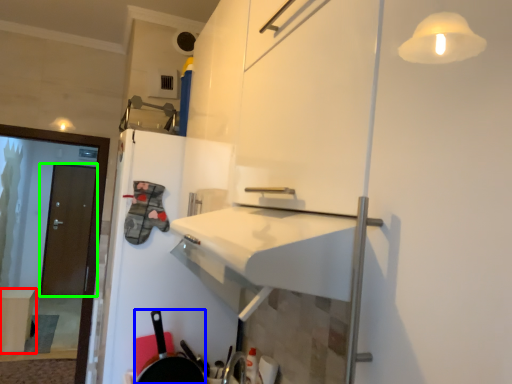
Question: Based on their relative distances, which object is farther from table (highlighted by a red box)? Choose from frying pan (highlighted by a blue box) and door (highlighted by a green box).

Choices:
 (A) frying pan
 (B) door

Answer: (A)